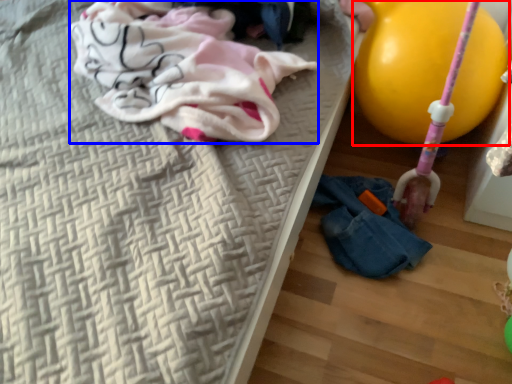
Question: Which of the following is the farthest to the observer, balloon (highlighted by a red box) or clothing (highlighted by a blue box)?

Choices:
 (A) balloon
 (B) clothing

Answer: (A)